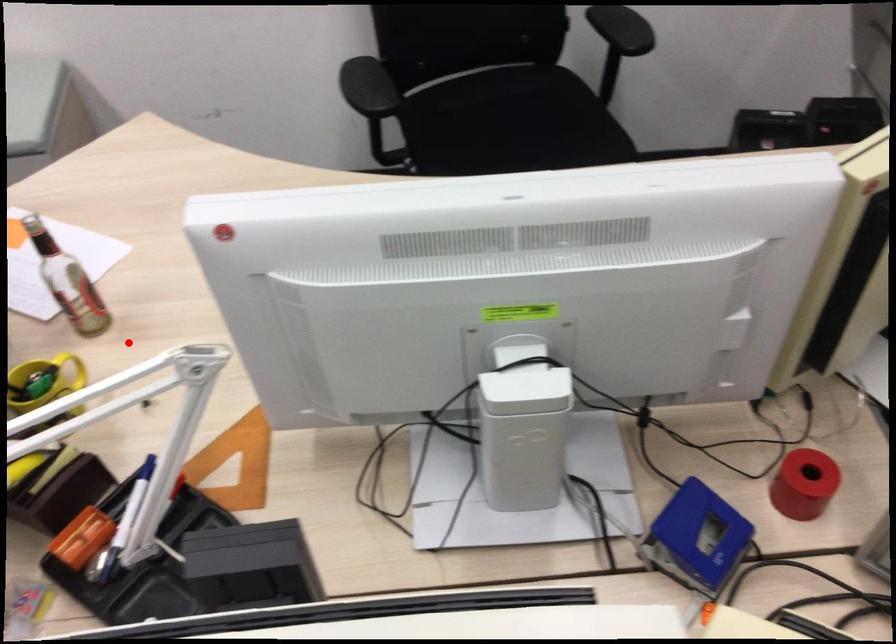
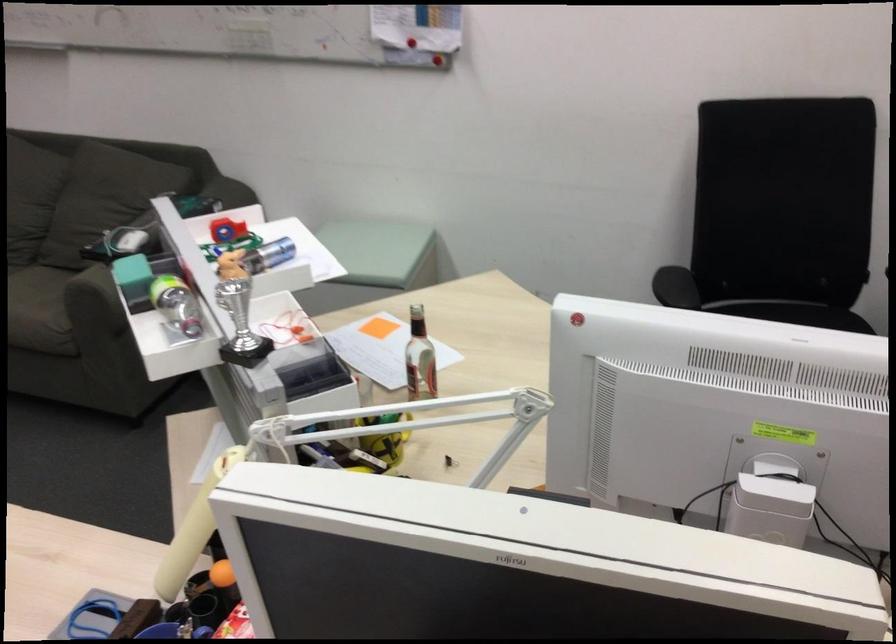
In the second image, find the point that corresponds to the highlighted location in the first image.

(437, 410)